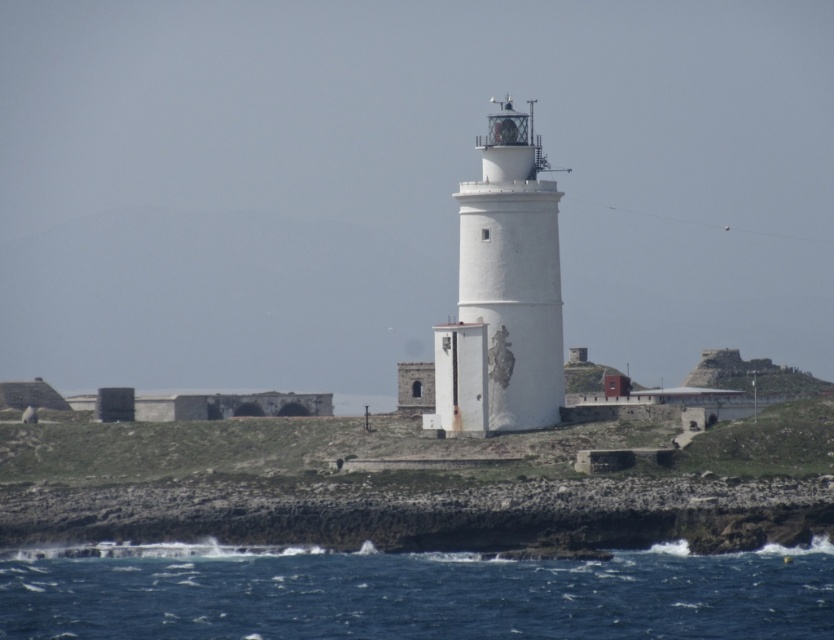
You are standing on a cliff overlooking the ocean and see the white smooth lighthouse at center and the blue water at lower left. Which object is positioned lower in the scene?

The blue water at lower left is positioned lower than the white smooth lighthouse at center.